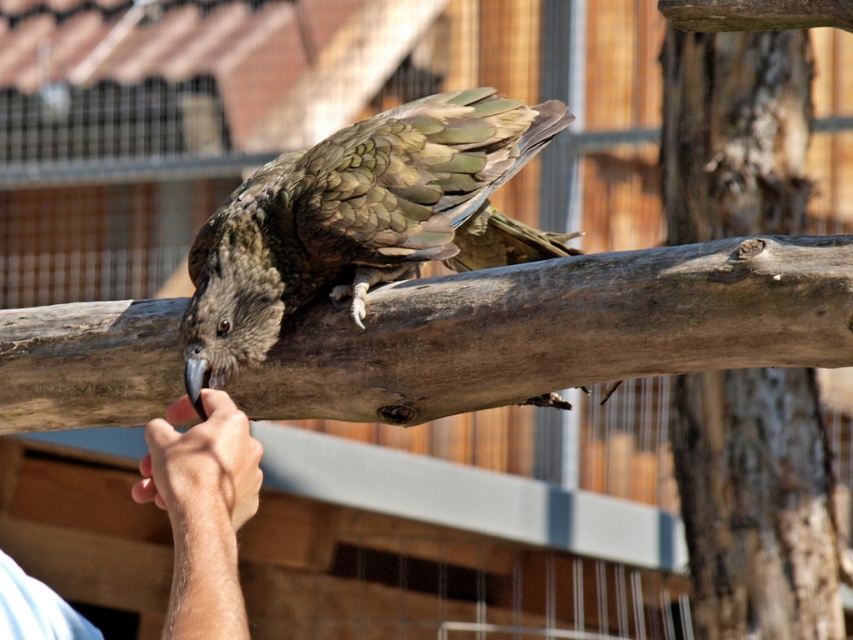
Is smooth brown log at center above light skin hand at lower left?

Correct, smooth brown log at center is located above light skin hand at lower left.

Between point (799, 97) and point (18, 580), which one is positioned in front?

Positioned in front is point (18, 580).

Identify the location of smooth brown log at center. (757, 502).

Is point (294, 289) closer to viewer compared to point (213, 467)?

No, (294, 289) is further to viewer.

Is greenish-brown feathered bird at center taller than light skin hand at lower left?

Yes, greenish-brown feathered bird at center is taller than light skin hand at lower left.

The image size is (853, 640). What do you see at coordinates (361, 220) in the screenshot?
I see `greenish-brown feathered bird at center` at bounding box center [361, 220].

This screenshot has width=853, height=640. I want to click on greenish-brown feathered bird at center, so click(361, 220).

Can you confirm if brown rough wood at center is positioned above greenish-brown feathered bird at center?

No.

Is point (141, 413) positioned in front of point (309, 285)?

No, (141, 413) is further to viewer.

Is point (456, 365) more distant than point (436, 220)?

No, (456, 365) is closer to viewer.

Find the location of a particular element. The height and width of the screenshot is (640, 853). brown rough wood at center is located at coordinates (560, 330).